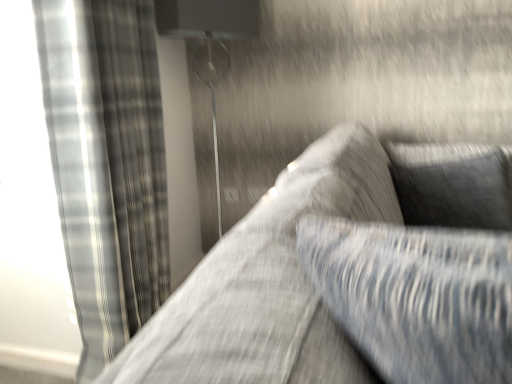
Question: Is metallic silver lamp at upper center wider than plaid fabric curtain at left?

Choices:
 (A) yes
 (B) no

Answer: (A)

Question: From a real-world perspective, is metallic silver lamp at upper center over plaid fabric curtain at left?

Choices:
 (A) yes
 (B) no

Answer: (A)

Question: Considering the relative sizes of metallic silver lamp at upper center and plaid fabric curtain at left in the image provided, is metallic silver lamp at upper center taller than plaid fabric curtain at left?

Choices:
 (A) yes
 (B) no

Answer: (B)

Question: Can you confirm if metallic silver lamp at upper center is bigger than plaid fabric curtain at left?

Choices:
 (A) no
 (B) yes

Answer: (A)

Question: Can you confirm if metallic silver lamp at upper center is shorter than plaid fabric curtain at left?

Choices:
 (A) no
 (B) yes

Answer: (B)

Question: Is plaid fabric curtain at left taller or shorter than black textured pillow at upper right?

Choices:
 (A) tall
 (B) short

Answer: (A)

Question: From a real-world perspective, relative to black textured pillow at upper right, is plaid fabric curtain at left vertically above or below?

Choices:
 (A) below
 (B) above

Answer: (B)

Question: Looking at their shapes, would you say plaid fabric curtain at left is wider or thinner than black textured pillow at upper right?

Choices:
 (A) thin
 (B) wide

Answer: (B)

Question: Is plaid fabric curtain at left bigger or smaller than black textured pillow at upper right?

Choices:
 (A) small
 (B) big

Answer: (B)

Question: Visually, is metallic silver lamp at upper center positioned to the left or to the right of black textured pillow at upper right?

Choices:
 (A) right
 (B) left

Answer: (B)

Question: Looking at the image, does metallic silver lamp at upper center seem bigger or smaller compared to black textured pillow at upper right?

Choices:
 (A) big
 (B) small

Answer: (A)

Question: Is metallic silver lamp at upper center inside or outside of black textured pillow at upper right?

Choices:
 (A) outside
 (B) inside

Answer: (A)

Question: In terms of width, does metallic silver lamp at upper center look wider or thinner when compared to black textured pillow at upper right?

Choices:
 (A) wide
 (B) thin

Answer: (A)

Question: Is textured gray couch at center taller or shorter than black textured pillow at upper right?

Choices:
 (A) short
 (B) tall

Answer: (A)

Question: In terms of width, does textured gray couch at center look wider or thinner when compared to black textured pillow at upper right?

Choices:
 (A) thin
 (B) wide

Answer: (B)